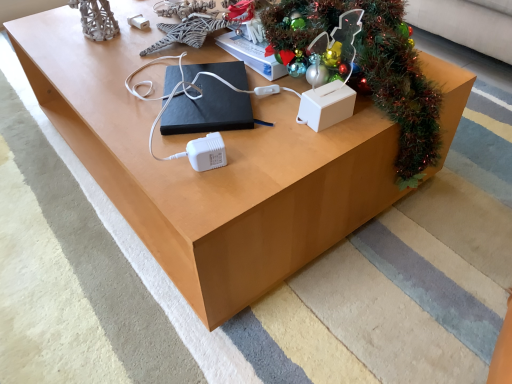
Find the location of `unoccupied area in front of black matte book at center`. unoccupied area in front of black matte book at center is located at coordinates (210, 162).